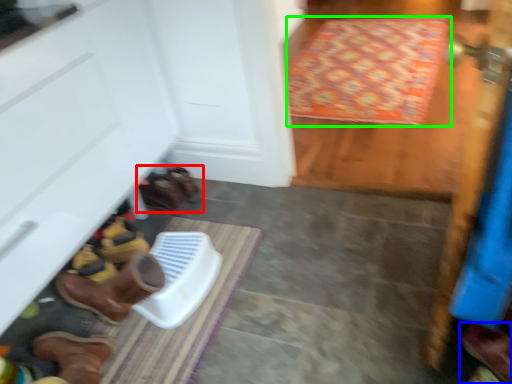
Question: Estimate the real-world distances between objects in this image. Which object is farther from footwear (highlighted by a red box), footwear (highlighted by a blue box) or doormat (highlighted by a green box)?

Choices:
 (A) footwear
 (B) doormat

Answer: (B)